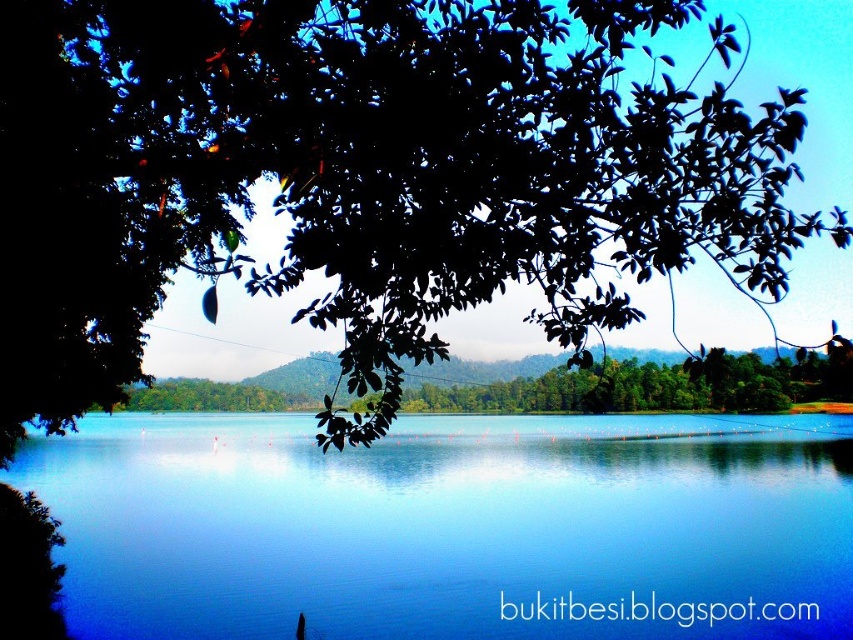
You are standing at the lakeside and want to walk to the point marked as point [106,314]. However, there is an obstacle at point [653,433]. Will you be able to see the destination point once you reach the obstacle?

Since point [106,314] is behind point [653,433], you will not be able to see the destination point once you reach the obstacle at point [653,433].